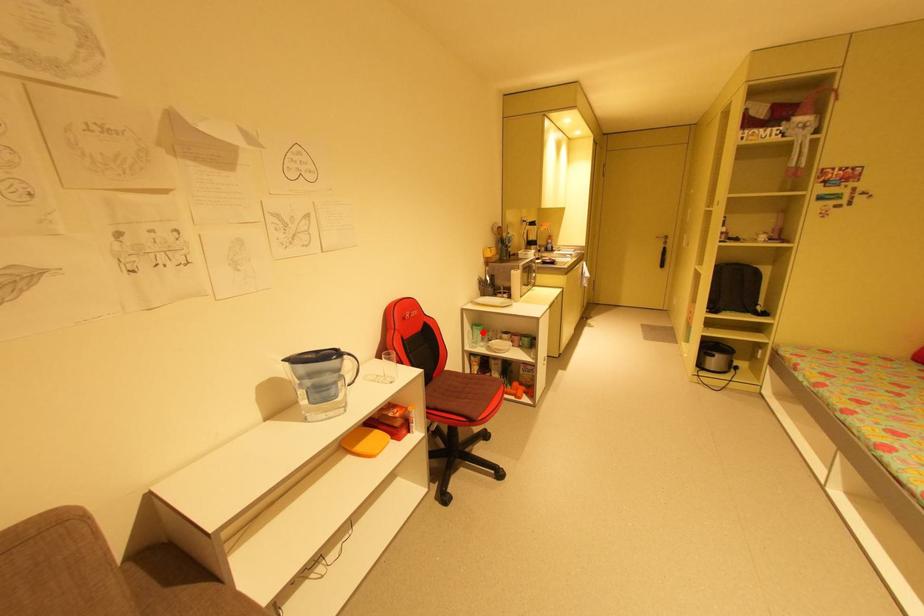
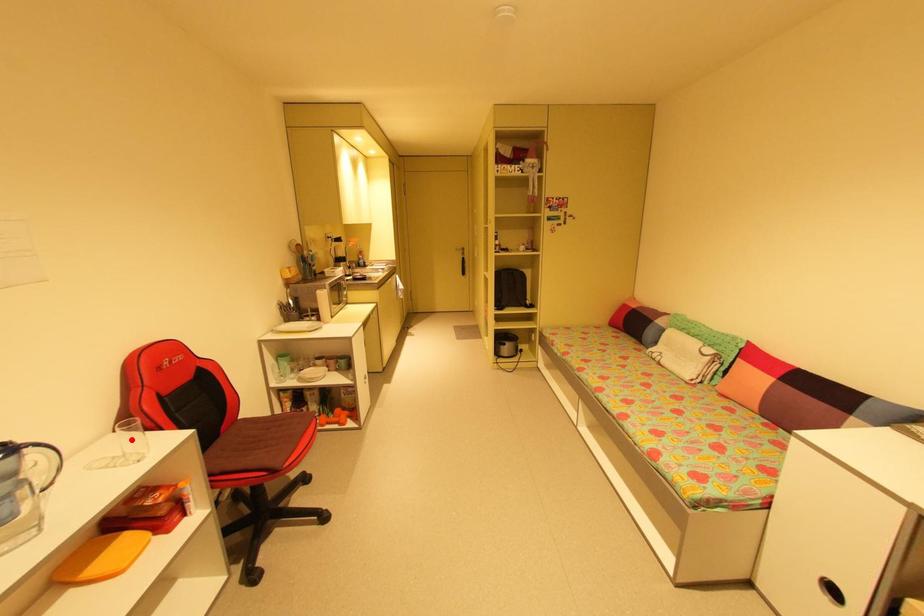
I am providing you with two images of the same scene from different viewpoints. A red point is marked on the first image and another point is marked on the second image. Are the points marked in image1 and image2 representing the same 3D position?

No